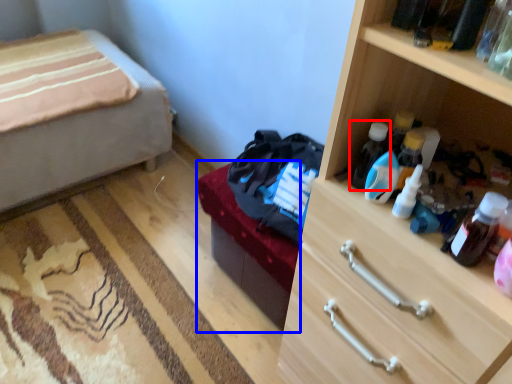
Question: Which object is closer to the camera taking this photo, bottle (highlighted by a red box) or bed frame (highlighted by a blue box)?

Choices:
 (A) bottle
 (B) bed frame

Answer: (A)